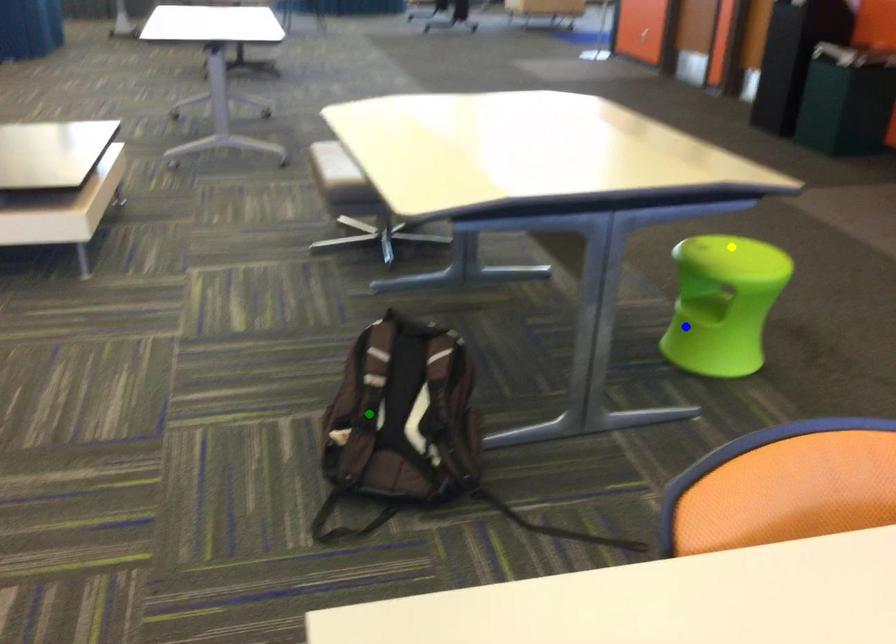
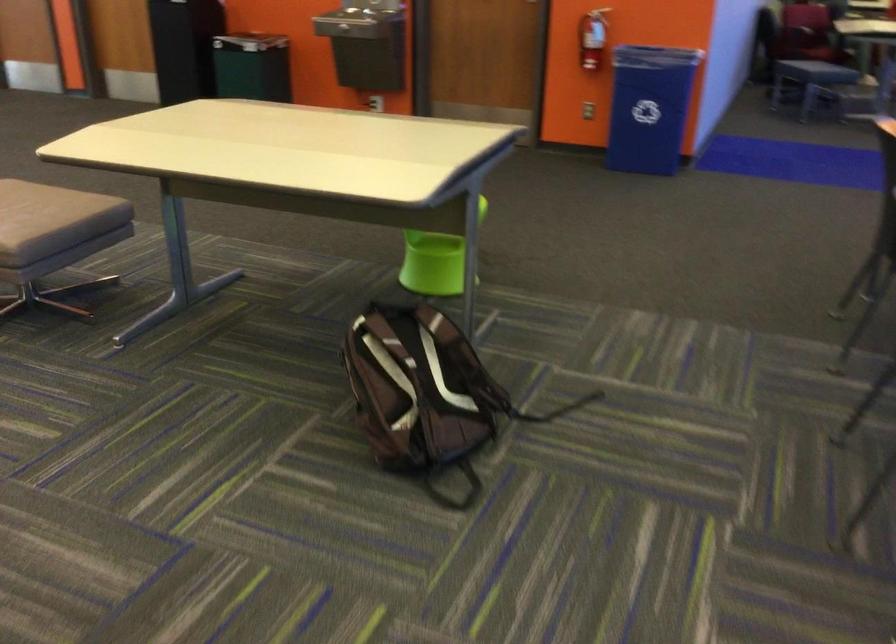
I am providing you with two images of the same scene from different viewpoints. Three points are marked in image1. Which point corresponds to a part or object that is occluded in image2?In image1, three points are marked. Which of them correspond to a part or object that is occluded in image2?Among the three points shown in image1, which one corresponds to a part or object that is no longer visible due to occlusion in image2?

Invisible in image2: yellow point.